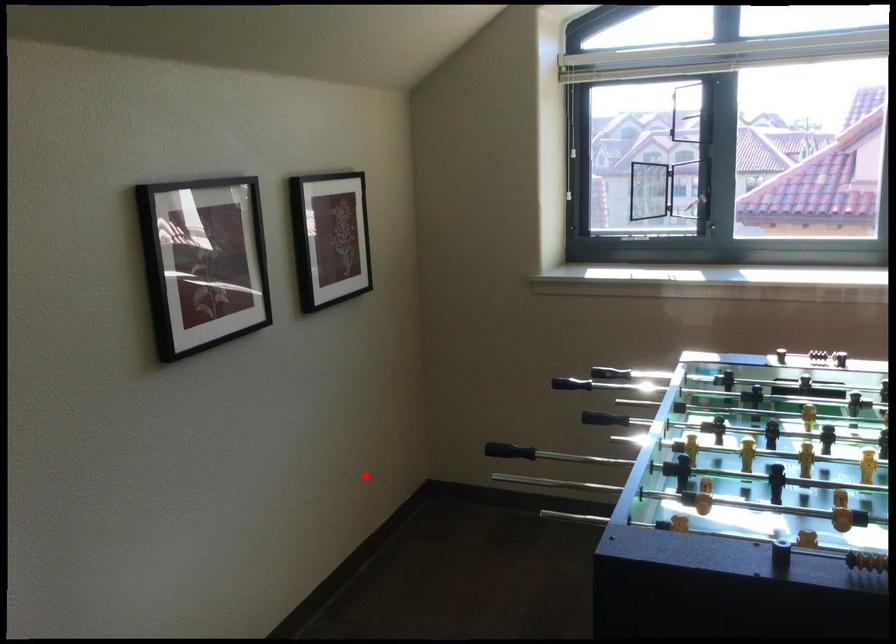
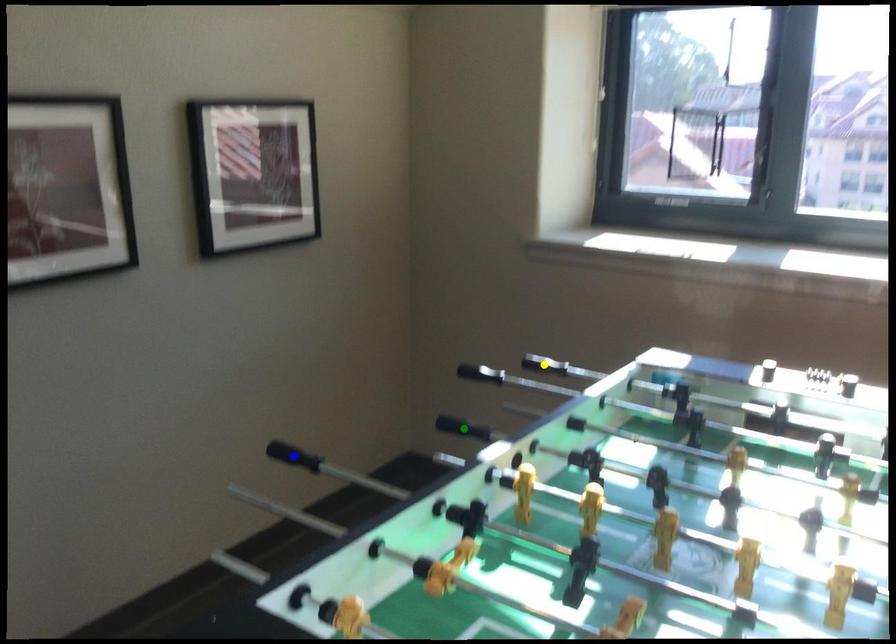
Question: I am providing you with two images of the same scene from different viewpoints. A red point is marked on the first image. You are given multiple points on the second image. Which point in image 2 represents the same 3d spot as the red point in image 1?

Choices:
 (A) yellow point
 (B) green point
 (C) blue point

Answer: (C)